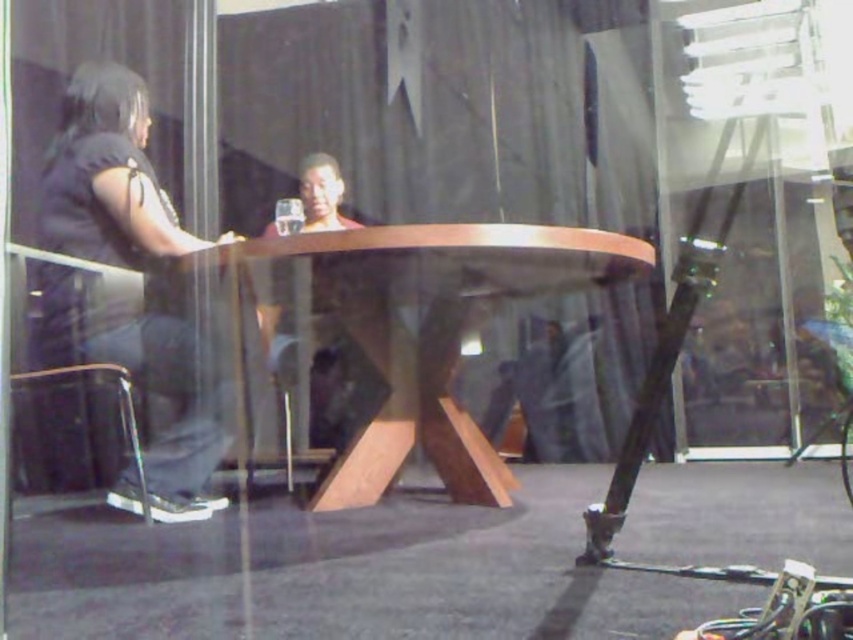
Question: Is wooden at center bigger than black fabric shirt at left?

Choices:
 (A) yes
 (B) no

Answer: (A)

Question: Which point is closer to the camera?

Choices:
 (A) (434, 385)
 (B) (207, 390)

Answer: (B)

Question: Does wooden at center have a smaller size compared to black fabric shirt at left?

Choices:
 (A) yes
 (B) no

Answer: (B)

Question: Which object is farther from the camera taking this photo?

Choices:
 (A) black fabric shirt at left
 (B) wooden at center

Answer: (A)

Question: Which point appears closest to the camera in this image?

Choices:
 (A) (45, 244)
 (B) (329, 276)

Answer: (B)

Question: Does wooden at center appear on the right side of black fabric shirt at left?

Choices:
 (A) no
 (B) yes

Answer: (B)